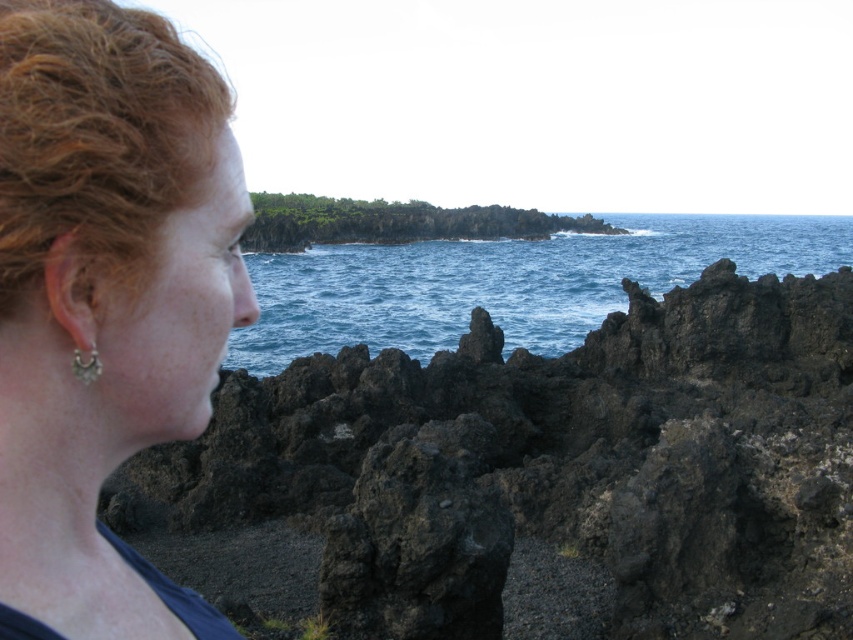
Question: Is black volcanic rock at center positioned in front of blue water at center?

Choices:
 (A) no
 (B) yes

Answer: (B)

Question: Is black volcanic rock at center positioned at the back of matte black hair at left?

Choices:
 (A) yes
 (B) no

Answer: (A)

Question: Which of these objects is positioned farthest from the silver metallic earring at lower left?

Choices:
 (A) blue water at center
 (B) curly auburn hair at left
 (C) black volcanic rock at center

Answer: (A)

Question: Does blue water at center have a smaller size compared to silver metallic earring at lower left?

Choices:
 (A) no
 (B) yes

Answer: (A)

Question: Which of the following is the closest to the observer?

Choices:
 (A) (195, 96)
 (B) (718, 266)

Answer: (A)

Question: Which point is closer to the camera?

Choices:
 (A) silver metallic earring at lower left
 (B) blue water at center
 (C) curly auburn hair at left

Answer: (C)